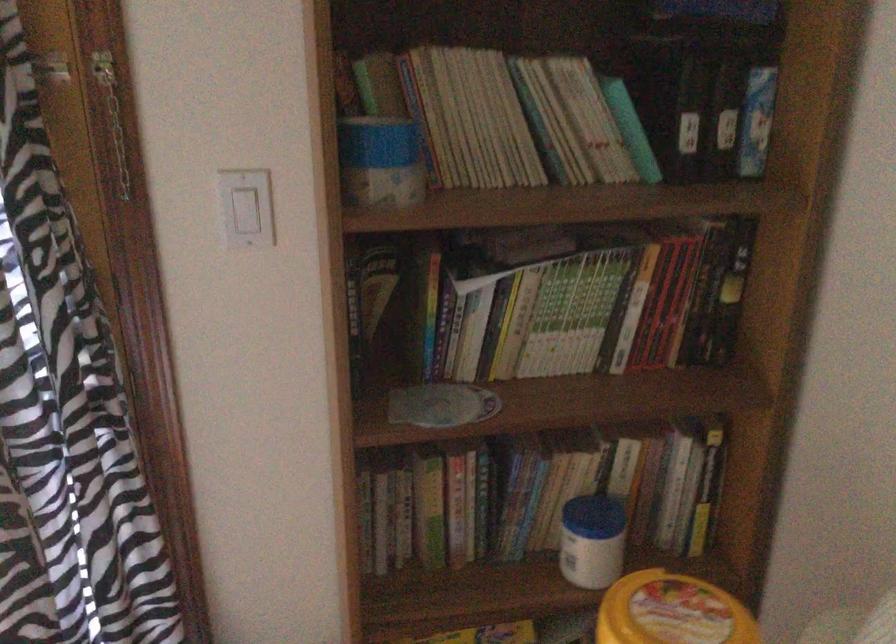
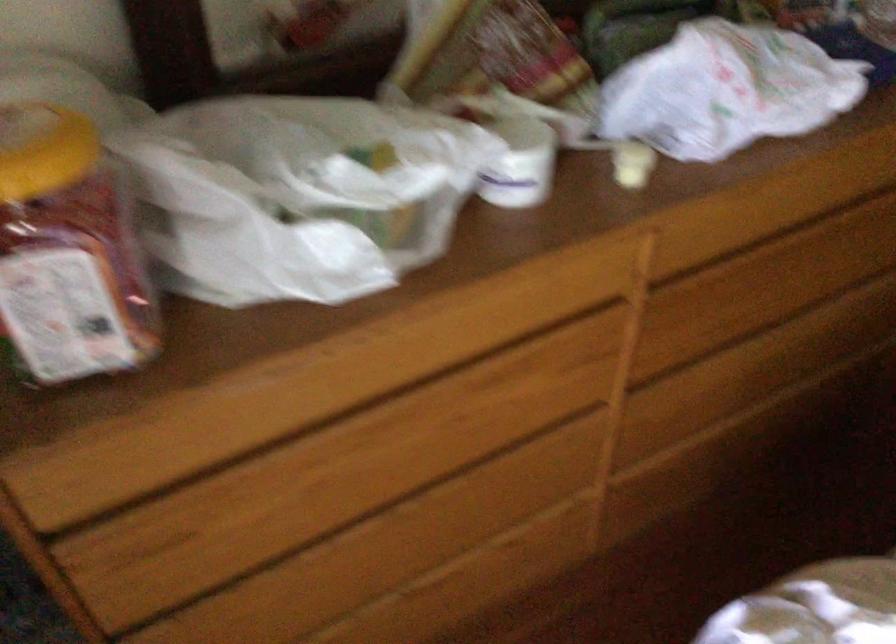
Based on the continuous images, in which direction is the camera rotating?

The camera rotated toward right-down.